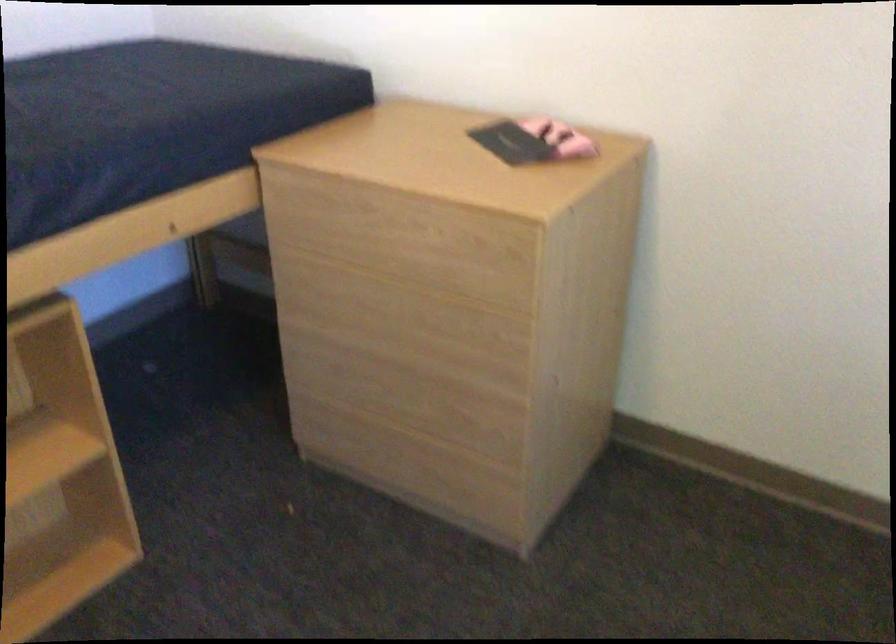
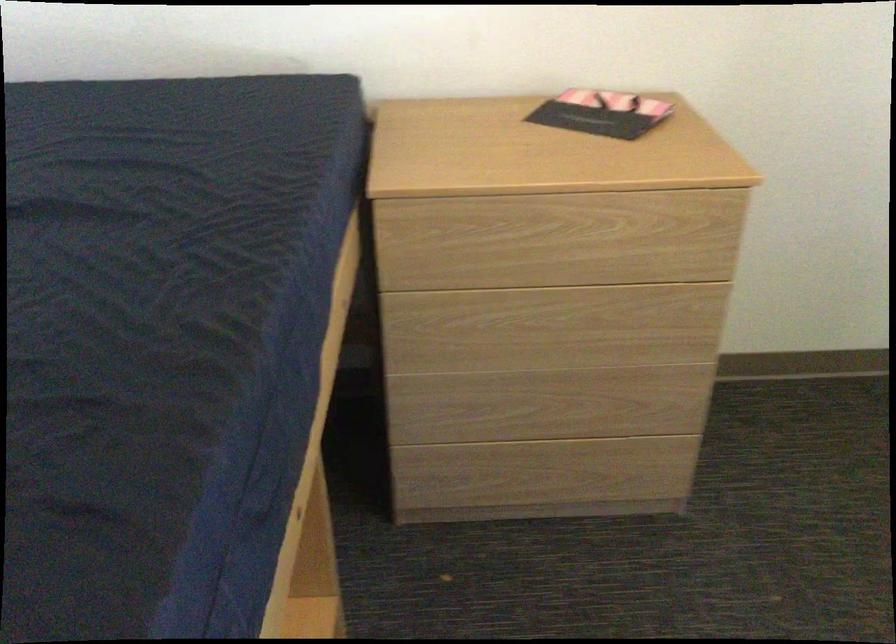
Find the pixel in the second image that matches [383,234] in the first image.

(557, 240)